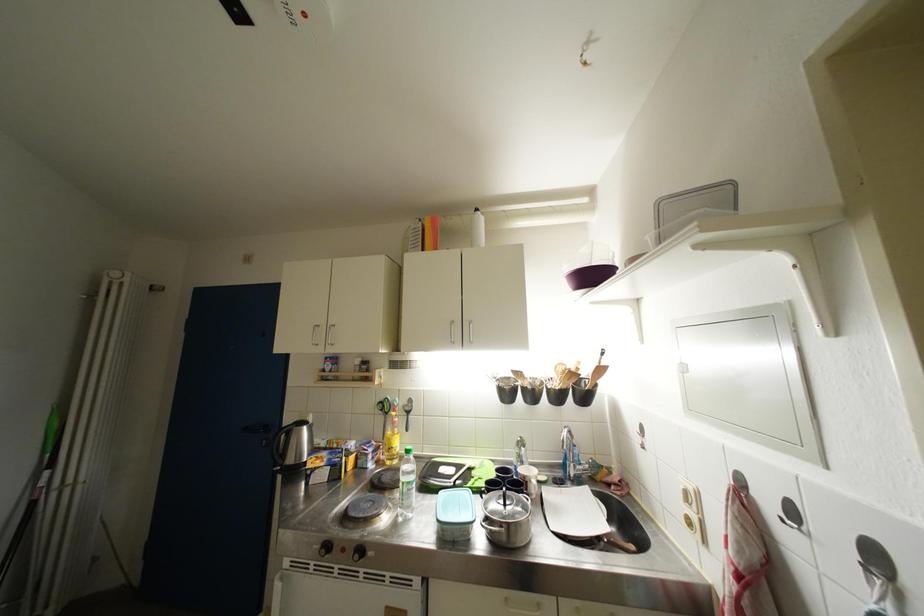
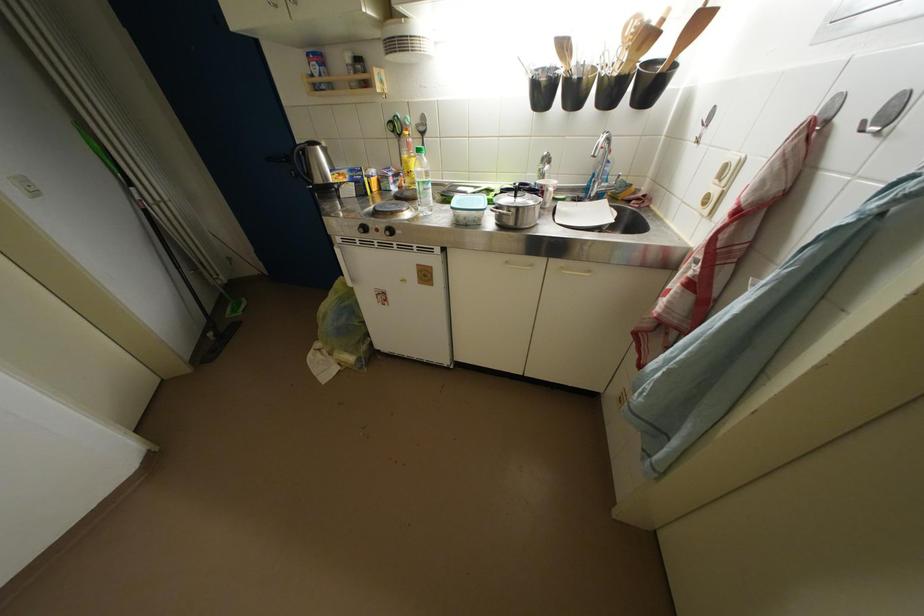
In the second image, find the point that corresponds to point (396, 444) in the first image.

(412, 167)